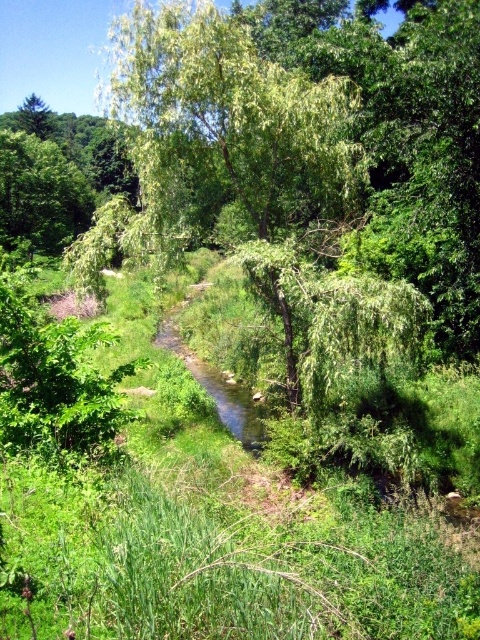
Question: Does green leafy grass at center have a larger size compared to green leafy tree at center?

Choices:
 (A) no
 (B) yes

Answer: (A)

Question: Can you confirm if green leafy tree at center is positioned above clear water stream at center?

Choices:
 (A) yes
 (B) no

Answer: (A)

Question: Does green leafy grass at center have a greater width compared to green leafy tree at center?

Choices:
 (A) no
 (B) yes

Answer: (B)

Question: Which of these objects is positioned farthest from the green leafy tree at center?

Choices:
 (A) green leafy grass at center
 (B) clear water stream at center

Answer: (B)

Question: Among these points, which one is nearest to the camera?

Choices:
 (A) (252, 429)
 (B) (348, 499)
 (C) (218, 163)

Answer: (B)

Question: Which point appears closest to the camera in this image?

Choices:
 (A) (236, 426)
 (B) (408, 561)
 (C) (231, 131)

Answer: (B)